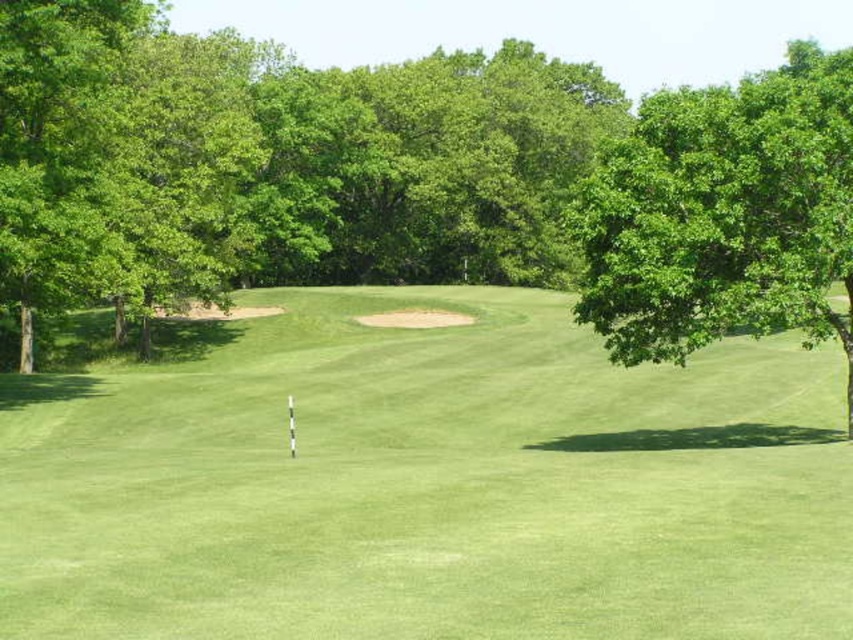
You are a golfer standing at the tee, aiming to hit the ball towards the green grassy golf course at center. Based on the coordinates provided, in which direction should you aim your shot relative to your current position?

The green grassy golf course at center is located at coordinates point (428,484). Since the x and y coordinates are both greater than 0.5, you should aim your shot towards the upper right direction from your current position.

You are a golfer standing on the green grassy golf course at center and want to hit the ball towards the green leafy tree at right. Considering the space each occupies in the image, which area would require more adjustment in your swing to reach accurately?

The green leafy tree at right requires more adjustment in your swing because it occupies more space in the image than the green grassy golf course at center, meaning it is larger and potentially farther away.

You are a golfer standing on the tee, preparing to hit your ball towards the green grassy golf course at center and the green leafy tree at right. Which object is wider from your perspective?

The green grassy golf course at center might be wider than green leafy tree at right.